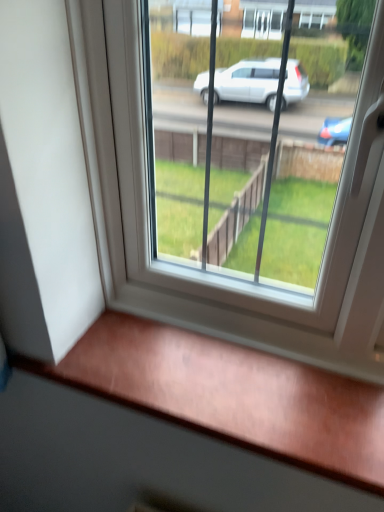
This screenshot has width=384, height=512. Describe the element at coordinates (234, 393) in the screenshot. I see `wooden at lower center` at that location.

You are a GUI agent. You are given a task and a screenshot of the screen. Output one action in this format:
    pyautogui.click(x=<x>, y=<y>)
    Task: Click on the wooden at lower center
    This screenshot has height=512, width=384.
    Given the screenshot: What is the action you would take?
    [x=234, y=393]

In order to face wooden at lower center, should I rotate leftwards or rightwards?

A 1.130 degree turn to the left will do.

Locate an element on the screen. Image resolution: width=384 pixels, height=512 pixels. wooden at lower center is located at coordinates (234, 393).